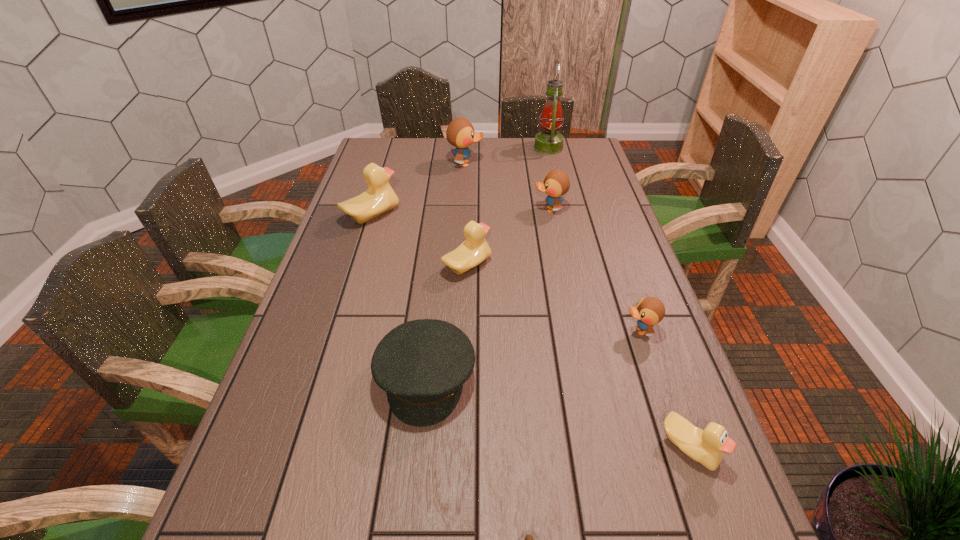
I want to click on free space located on the front-facing side of the second blue duck from right to left, so click(x=444, y=210).

Where is `free space located at the beak of the fourth farthest duck`? free space located at the beak of the fourth farthest duck is located at coordinates (592, 266).

Identify the location of free space located on the front-facing side of the second nearest duck. (594, 331).

Where is `vacant space located on the front-facing side of the second nearest duck`? This screenshot has width=960, height=540. vacant space located on the front-facing side of the second nearest duck is located at coordinates (590, 331).

At what (x,y) coordinates should I click in order to perform the action: click on free region located 0.320m on the front-facing side of the second nearest duck. Please return your answer as a coordinate pair (x, y). The image size is (960, 540). Looking at the image, I should click on (494, 331).

I want to click on vacant space located 0.060m on the front-facing side of the gray beret, so click(x=418, y=455).

Find the location of a particular element. This screenshot has width=960, height=540. vacant space located 0.110m at the beak of the nearest beige duck is located at coordinates (722, 539).

Locate an element on the screen. This screenshot has height=540, width=960. oil lamp present at the far edge is located at coordinates (548, 142).

You are a GUI agent. You are given a task and a screenshot of the screen. Output one action in this format:
    pyautogui.click(x=<x>, y=<y>)
    Task: Click on the duck located at the far edge
    This screenshot has width=960, height=540.
    Given the screenshot: What is the action you would take?
    pyautogui.click(x=460, y=133)

At what (x,y) coordinates should I click in order to perform the action: click on object present at the left edge. Please return your answer as a coordinate pair (x, y). The height and width of the screenshot is (540, 960). Looking at the image, I should click on (379, 198).